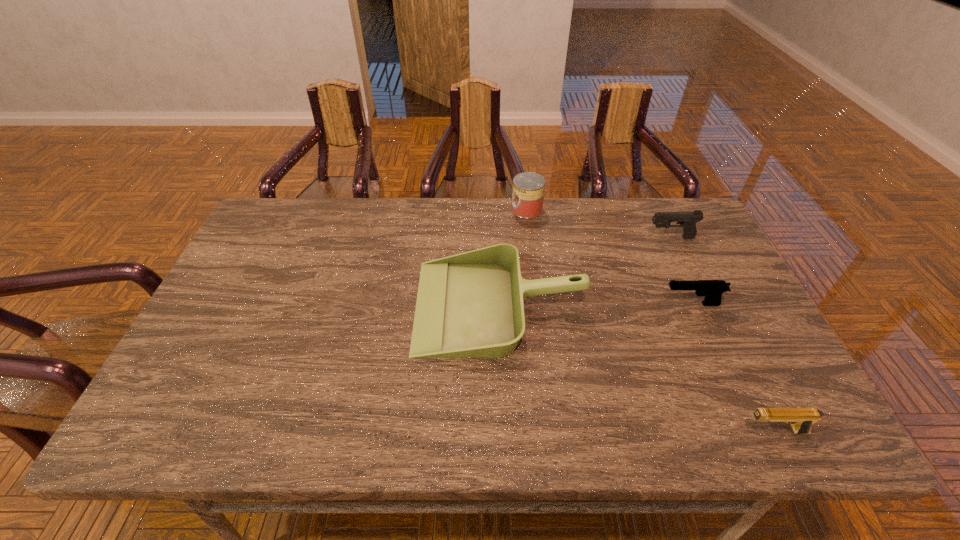
Point out which pistol is positioned as the second nearest to the farthest object. Please provide its 2D coordinates. Your answer should be formatted as a tuple, i.e. [(x, y)], where the tuple contains the x and y coordinates of a point satisfying the conditions above.

[(712, 289)]